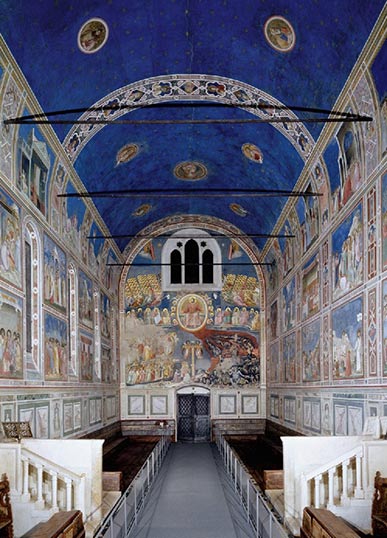
Locate an element on the screen. This screenshot has width=387, height=538. framd pictures on left side of door is located at coordinates (137, 402), (155, 403).